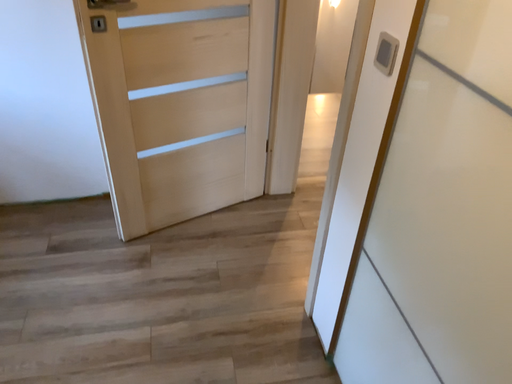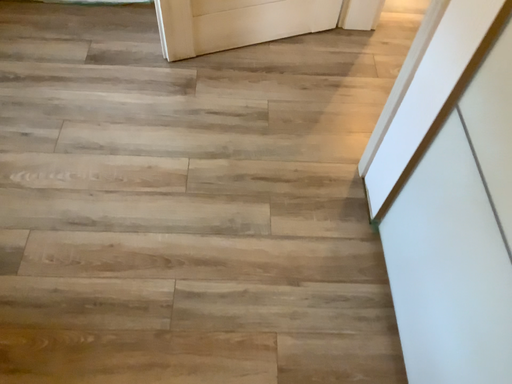
Question: How did the camera likely rotate when shooting the video?

Choices:
 (A) rotated downward
 (B) rotated upward

Answer: (A)